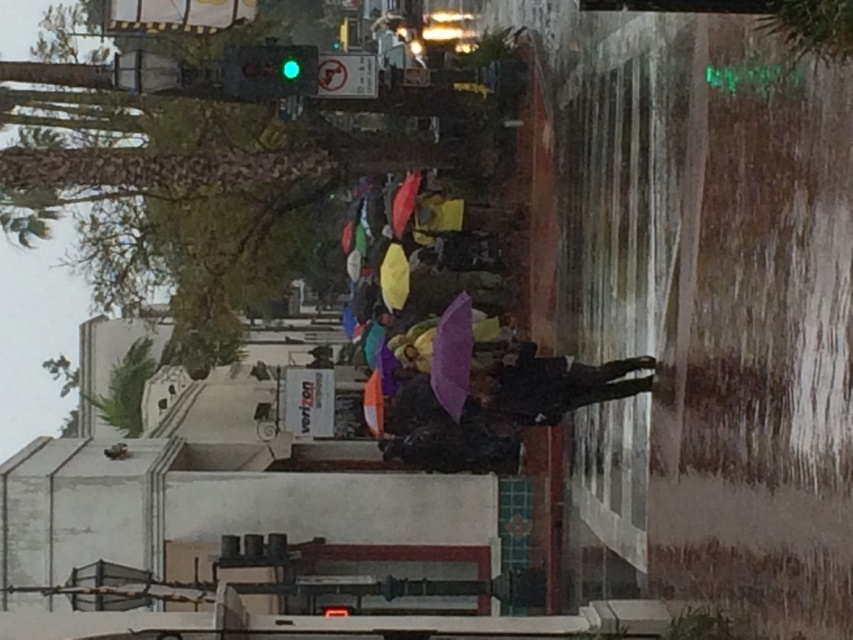
You are a delivery person carrying a package and need to walk through the street. You see a dark matte jacket at center and a purple matte umbrella at center. Which item is wider so you can avoid it?

The dark matte jacket at center is wider than the purple matte umbrella at center, so you should avoid the dark matte jacket at center.

You are standing on the wet sidewalk and notice a dark matte jacket at center. Based on its position, can you estimate whether it is closer to the Verizon sign or the wet street reflections?

The dark matte jacket at center is located at point 0.602 on the x and 0.653 on the y axis. Since the Verizon sign is on the building and the wet street reflections are lower down, the jacket is closer to the Verizon sign.

You are a pedestrian trying to stay dry in the rain. You see a dark matte jacket at center and a purple matte umbrella at center. Which item is taller and could potentially provide better rain protection?

The purple matte umbrella at center is taller than the dark matte jacket at center, so it could potentially provide better rain protection.